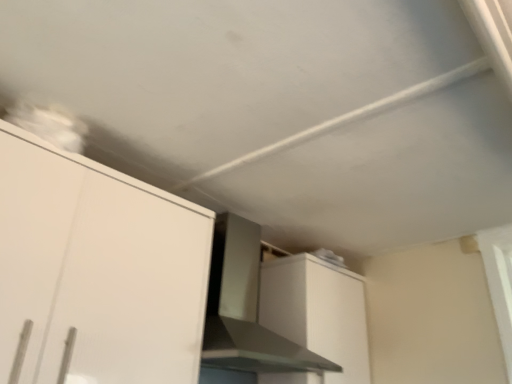
Question: Is satin silver vent at center taller than white matte cabinet at upper left, which is counted as the first cabinetry, starting from the front?

Choices:
 (A) no
 (B) yes

Answer: (A)

Question: Is satin silver vent at center positioned in front of white matte cabinet at upper left, which is counted as the 2th cabinetry, starting from the back?

Choices:
 (A) no
 (B) yes

Answer: (A)

Question: Considering the relative sizes of satin silver vent at center and white matte cabinet at upper left, which is counted as the second cabinetry, starting from the right, in the image provided, is satin silver vent at center bigger than white matte cabinet at upper left, which is counted as the second cabinetry, starting from the right,?

Choices:
 (A) yes
 (B) no

Answer: (A)

Question: Is satin silver vent at center not within white matte cabinet at upper left, which is counted as the 2th cabinetry, starting from the back?

Choices:
 (A) no
 (B) yes

Answer: (B)

Question: Can you confirm if satin silver vent at center is wider than white matte cabinet at upper left, which is counted as the second cabinetry, starting from the right?

Choices:
 (A) yes
 (B) no

Answer: (A)

Question: Considering the relative positions of satin silver vent at center and white matte cabinet at upper left, which is counted as the first cabinetry, starting from the front, in the image provided, is satin silver vent at center behind white matte cabinet at upper left, which is counted as the first cabinetry, starting from the front,?

Choices:
 (A) yes
 (B) no

Answer: (A)

Question: Is satin silver vent at center outside white matte cabinet at upper right, the 1th cabinetry from the back?

Choices:
 (A) yes
 (B) no

Answer: (A)

Question: Is satin silver vent at center oriented away from white matte cabinet at upper right, arranged as the 2th cabinetry when viewed from the front?

Choices:
 (A) yes
 (B) no

Answer: (B)

Question: From the image's perspective, is satin silver vent at center located beneath white matte cabinet at upper right, arranged as the 2th cabinetry when viewed from the front?

Choices:
 (A) no
 (B) yes

Answer: (A)

Question: Considering the relative sizes of satin silver vent at center and white matte cabinet at upper right, which appears as the second cabinetry when viewed from the left, in the image provided, is satin silver vent at center shorter than white matte cabinet at upper right, which appears as the second cabinetry when viewed from the left,?

Choices:
 (A) yes
 (B) no

Answer: (B)

Question: Can you confirm if satin silver vent at center is positioned to the right of white matte cabinet at upper right, the 1th cabinetry from the back?

Choices:
 (A) yes
 (B) no

Answer: (B)

Question: Is white matte cabinet at upper right, the 1th cabinetry from the back, inside satin silver vent at center?

Choices:
 (A) yes
 (B) no

Answer: (B)

Question: Would you say white matte cabinet at upper right, which appears as the second cabinetry when viewed from the left, is part of white matte cabinet at upper left, which is counted as the 2th cabinetry, starting from the back,'s contents?

Choices:
 (A) yes
 (B) no

Answer: (B)